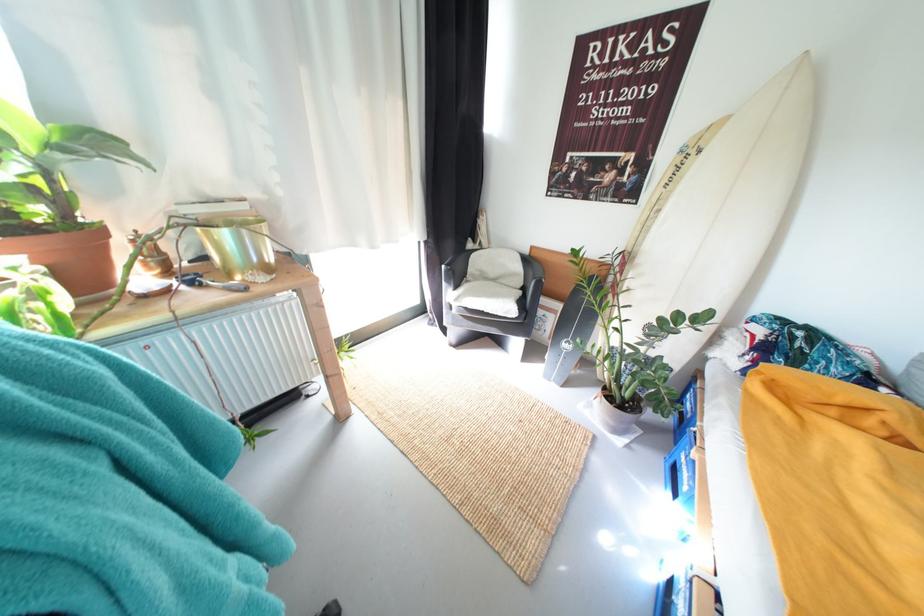
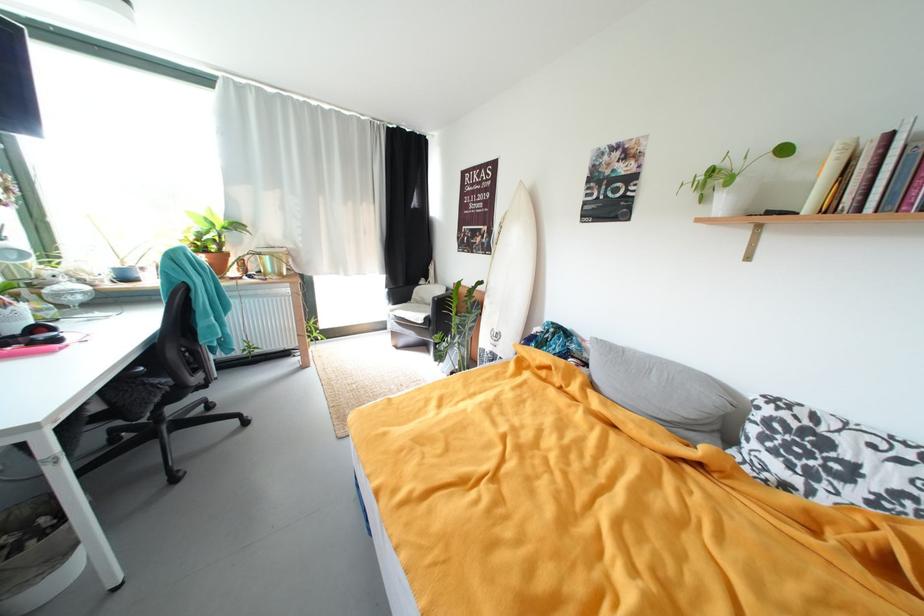
Find the pixel in the second image that matches the point at 650,168 in the first image.

(497, 235)